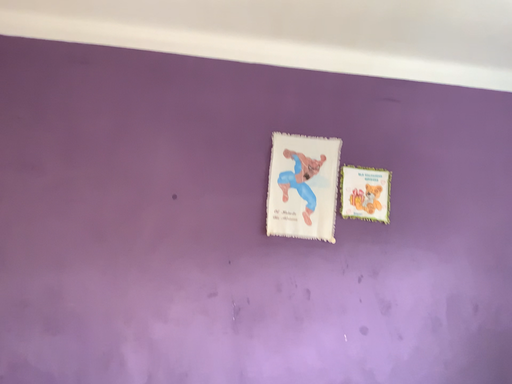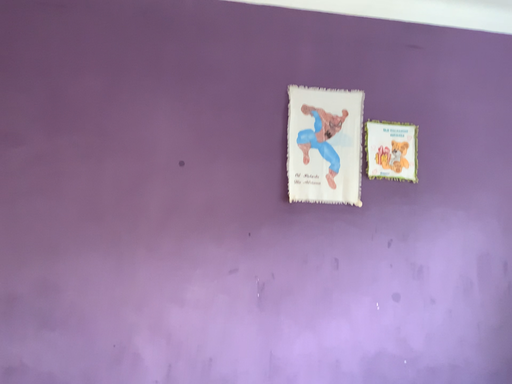
Question: How did the camera likely rotate when shooting the video?

Choices:
 (A) rotated left
 (B) rotated right

Answer: (B)